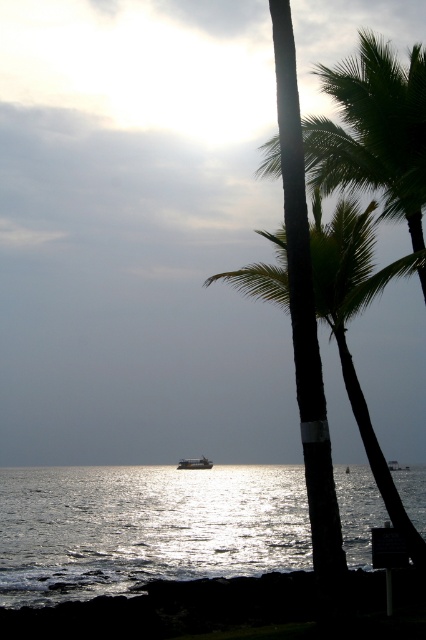
You are a photographer wanting to capture the reflection of the palm trees in the shiny reflective water at center. Based on the scene description, can you confirm if the palm trees are positioned such that their reflection would appear in the water?

The shiny reflective water at center is located at point (x=144, y=528). Since the palm trees are in the foreground and positioned near the center of the image, their reflection should appear in the shiny reflective water at center.

You are a photographer trying to capture the sunset scene. You notice the black smooth palm tree at center and the metallic silver boat at center. Which object should you focus on if you want to emphasize the silhouette effect in your photo?

The black smooth palm tree at center has a larger size compared to the metallic silver boat at center, so focusing on it would better emphasize the silhouette effect due to its prominence in the scene.